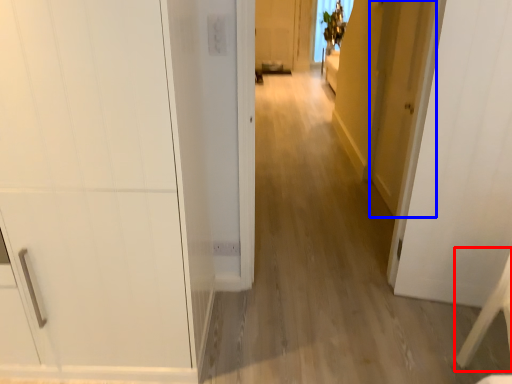
Question: Which point is further to the camera, furniture (highlighted by a red box) or door (highlighted by a blue box)?

Choices:
 (A) furniture
 (B) door

Answer: (B)